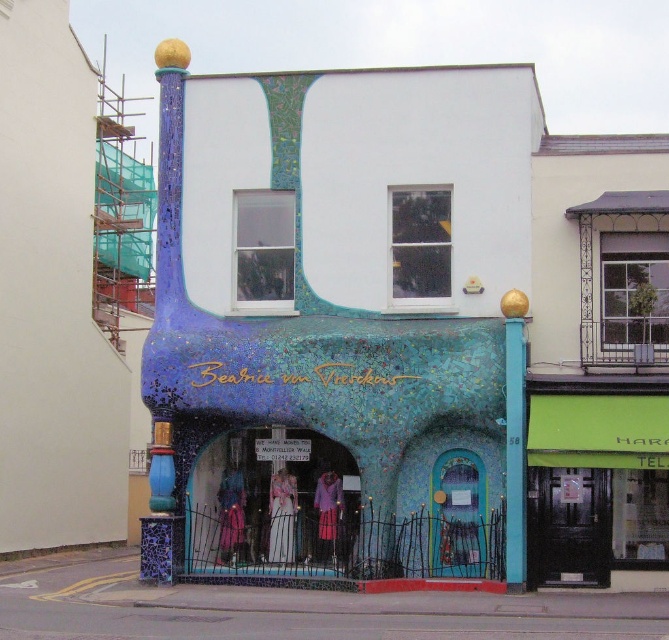
Image resolution: width=669 pixels, height=640 pixels. Find the location of `green fabric awning at upper right`. green fabric awning at upper right is located at coordinates (595, 486).

Does green fabric awning at upper right come behind teal mosaic door at lower center?

That is False.

Who is more distant from viewer, (595, 577) or (173, 504)?

Positioned behind is point (173, 504).

The image size is (669, 640). Find the location of `green fabric awning at upper right`. green fabric awning at upper right is located at coordinates (595, 486).